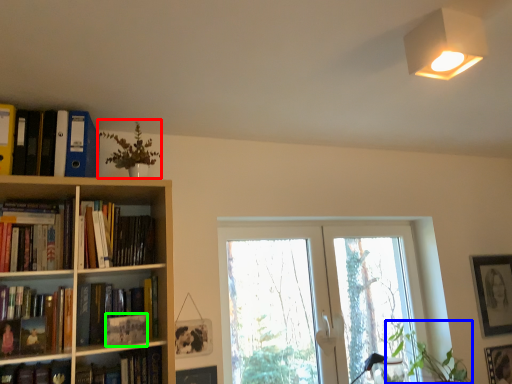
Question: Which is nearer to the plant (highlighted by a red box)? plant (highlighted by a blue box) or paperback book (highlighted by a green box).

Choices:
 (A) plant
 (B) paperback book

Answer: (B)